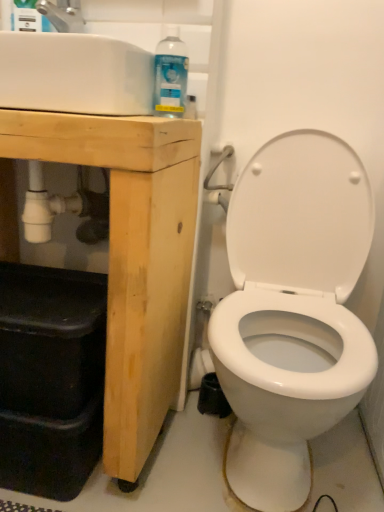
Question: Is white glossy sink at upper left bigger than clear plastic spray bottle at upper left, the first cleaning product positioned from the left?

Choices:
 (A) no
 (B) yes

Answer: (B)

Question: Is white glossy sink at upper left not within clear plastic spray bottle at upper left, which appears as the 2th cleaning product when viewed from the right?

Choices:
 (A) no
 (B) yes

Answer: (B)

Question: Considering the relative sizes of white glossy sink at upper left and clear plastic spray bottle at upper left, which appears as the 2th cleaning product when viewed from the right, in the image provided, is white glossy sink at upper left smaller than clear plastic spray bottle at upper left, which appears as the 2th cleaning product when viewed from the right,?

Choices:
 (A) yes
 (B) no

Answer: (B)

Question: Is white glossy sink at upper left taller than clear plastic spray bottle at upper left, which ranks as the first cleaning product in top-to-bottom order?

Choices:
 (A) no
 (B) yes

Answer: (A)

Question: Can you see white glossy sink at upper left touching clear plastic spray bottle at upper left, which ranks as the first cleaning product in top-to-bottom order?

Choices:
 (A) no
 (B) yes

Answer: (A)

Question: Is clear plastic spray bottle at upper left, marked as the 1th cleaning product in a right-to-left arrangement, inside or outside of natural wood cabinet at left?

Choices:
 (A) outside
 (B) inside

Answer: (A)

Question: From the image's perspective, is clear plastic spray bottle at upper left, the second cleaning product positioned from the top, positioned above or below natural wood cabinet at left?

Choices:
 (A) below
 (B) above

Answer: (B)

Question: Considering the positions of clear plastic spray bottle at upper left, the second cleaning product positioned from the top, and natural wood cabinet at left in the image, is clear plastic spray bottle at upper left, the second cleaning product positioned from the top, wider or thinner than natural wood cabinet at left?

Choices:
 (A) wide
 (B) thin

Answer: (B)

Question: Is point (155, 79) positioned closer to the camera than point (135, 367)?

Choices:
 (A) farther
 (B) closer

Answer: (B)

Question: In the image, is brushed metal faucet at upper left positioned in front of or behind white glossy sink at upper left?

Choices:
 (A) front
 (B) behind

Answer: (B)

Question: Considering the positions of brushed metal faucet at upper left and white glossy sink at upper left in the image, is brushed metal faucet at upper left wider or thinner than white glossy sink at upper left?

Choices:
 (A) thin
 (B) wide

Answer: (A)

Question: From the image's perspective, is brushed metal faucet at upper left located above or below white glossy sink at upper left?

Choices:
 (A) above
 (B) below

Answer: (A)

Question: Is point (41, 2) positioned closer to the camera than point (39, 90)?

Choices:
 (A) closer
 (B) farther

Answer: (B)

Question: Is brushed metal faucet at upper left taller or shorter than natural wood cabinet at left?

Choices:
 (A) tall
 (B) short

Answer: (B)

Question: In terms of width, does brushed metal faucet at upper left look wider or thinner when compared to natural wood cabinet at left?

Choices:
 (A) thin
 (B) wide

Answer: (A)